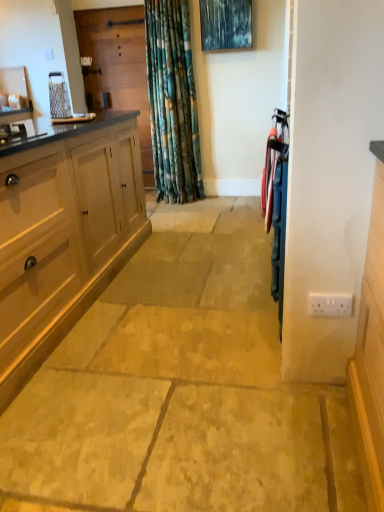
Question: Is white plastic electric outlet at lower right far from wooden screen door at upper left, which is the second screen door in front-to-back order?

Choices:
 (A) yes
 (B) no

Answer: (A)

Question: From the image's perspective, is white plastic electric outlet at lower right above wooden screen door at upper left, the second screen door from the right?

Choices:
 (A) no
 (B) yes

Answer: (A)

Question: Does white plastic electric outlet at lower right have a lesser width compared to wooden screen door at upper left, the second screen door from the right?

Choices:
 (A) no
 (B) yes

Answer: (B)

Question: From a real-world perspective, is white plastic electric outlet at lower right below wooden screen door at upper left, marked as the second screen door in a bottom-to-top arrangement?

Choices:
 (A) no
 (B) yes

Answer: (B)

Question: Is white plastic electric outlet at lower right positioned in front of wooden screen door at upper left, which is the second screen door in front-to-back order?

Choices:
 (A) no
 (B) yes

Answer: (B)

Question: From the image's perspective, relative to wooden screen door at upper left, which is the second screen door in front-to-back order, is metallic blue screen door at right, marked as the second screen door in a back-to-front arrangement, above or below?

Choices:
 (A) above
 (B) below

Answer: (B)

Question: Which is correct: metallic blue screen door at right, placed as the first screen door when sorted from right to left, is inside wooden screen door at upper left, the second screen door from the right, or outside of it?

Choices:
 (A) outside
 (B) inside

Answer: (A)

Question: Is metallic blue screen door at right, which ranks as the first screen door in bottom-to-top order, to the left or to the right of wooden screen door at upper left, the second screen door from the right, in the image?

Choices:
 (A) right
 (B) left

Answer: (A)

Question: Looking at the image, does metallic blue screen door at right, which ranks as the first screen door in bottom-to-top order, seem bigger or smaller compared to wooden screen door at upper left, which is the second screen door in front-to-back order?

Choices:
 (A) small
 (B) big

Answer: (A)

Question: From a real-world perspective, is white plastic electric outlet at lower right above or below metallic blue screen door at right, marked as the second screen door in a back-to-front arrangement?

Choices:
 (A) below
 (B) above

Answer: (A)

Question: In the image, is white plastic electric outlet at lower right positioned in front of or behind metallic blue screen door at right, the 1th screen door from the front?

Choices:
 (A) behind
 (B) front

Answer: (A)

Question: From the image's perspective, is white plastic electric outlet at lower right above or below metallic blue screen door at right, acting as the 2th screen door starting from the top?

Choices:
 (A) above
 (B) below

Answer: (B)

Question: Is white plastic electric outlet at lower right taller or shorter than metallic blue screen door at right, the 2th screen door from the left?

Choices:
 (A) short
 (B) tall

Answer: (A)

Question: From the image's perspective, is white plastic electric outlet at lower right positioned above or below wooden screen door at upper left, which is the second screen door in front-to-back order?

Choices:
 (A) below
 (B) above

Answer: (A)

Question: Based on their sizes in the image, would you say white plastic electric outlet at lower right is bigger or smaller than wooden screen door at upper left, which ranks as the 1th screen door in left-to-right order?

Choices:
 (A) big
 (B) small

Answer: (B)